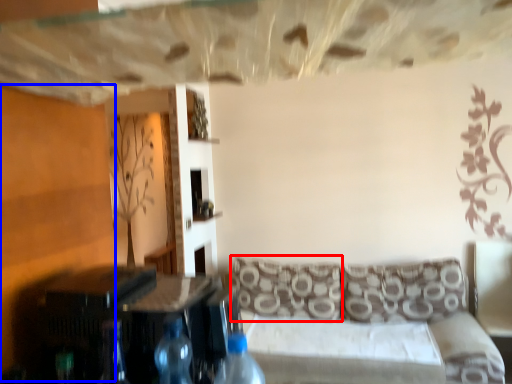
Question: Which point is closer to the camera, pillow (highlighted by a red box) or plywood (highlighted by a blue box)?

Choices:
 (A) pillow
 (B) plywood

Answer: (B)